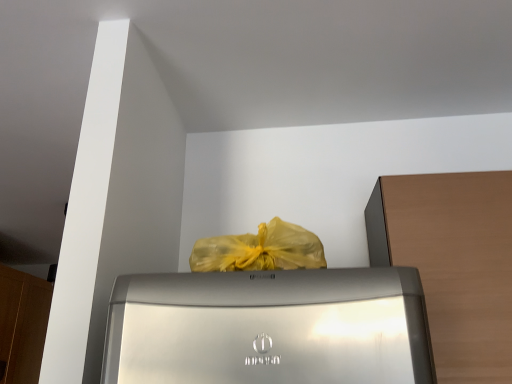
Locate an element on the screen. This screenshot has width=512, height=384. wooden cabinet at left, the 1th cabinetry when ordered from back to front is located at coordinates (22, 324).

Describe the element at coordinates (22, 324) in the screenshot. I see `wooden cabinet at left, the 1th cabinetry when ordered from back to front` at that location.

How much space does brown wood cabinet at right, placed as the 2th cabinetry when sorted from back to front, occupy horizontally?

The width of brown wood cabinet at right, placed as the 2th cabinetry when sorted from back to front, is 14.68 inches.

Identify the location of brown wood cabinet at right, which ranks as the 1th cabinetry in front-to-back order. (453, 263).

This screenshot has height=384, width=512. Describe the element at coordinates (453, 263) in the screenshot. I see `brown wood cabinet at right, which appears as the second cabinetry when viewed from the left` at that location.

At what (x,y) coordinates should I click in order to perform the action: click on wooden cabinet at left, the 1th cabinetry when ordered from back to front. Please return your answer as a coordinate pair (x, y). Looking at the image, I should click on (22, 324).

Is wooden cabinet at left, the 1th cabinetry when ordered from back to front, to the left or to the right of brown wood cabinet at right, the 1th cabinetry positioned from the right, in the image?

In the image, wooden cabinet at left, the 1th cabinetry when ordered from back to front, appears on the left side of brown wood cabinet at right, the 1th cabinetry positioned from the right.

Relative to brown wood cabinet at right, the 1th cabinetry positioned from the right, is wooden cabinet at left, which appears as the 1th cabinetry when viewed from the left, in front or behind?

Clearly, wooden cabinet at left, which appears as the 1th cabinetry when viewed from the left, is behind brown wood cabinet at right, the 1th cabinetry positioned from the right.

Does point (41, 285) come in front of point (511, 285)?

No, it is behind (511, 285).

From the image's perspective, which is above, wooden cabinet at left, the 1th cabinetry when ordered from back to front, or brown wood cabinet at right, the 1th cabinetry positioned from the right?

From the image's view, brown wood cabinet at right, the 1th cabinetry positioned from the right, is above.

From a real-world perspective, is wooden cabinet at left, positioned as the second cabinetry in right-to-left order, located beneath brown wood cabinet at right, which appears as the second cabinetry when viewed from the left?

Actually, wooden cabinet at left, positioned as the second cabinetry in right-to-left order, is physically above brown wood cabinet at right, which appears as the second cabinetry when viewed from the left, in the real world.

Is wooden cabinet at left, positioned as the second cabinetry in right-to-left order, wider than brown wood cabinet at right, placed as the 2th cabinetry when sorted from back to front?

No.

Which of these two, wooden cabinet at left, which appears as the 1th cabinetry when viewed from the left, or brown wood cabinet at right, the 1th cabinetry positioned from the right, stands taller?

wooden cabinet at left, which appears as the 1th cabinetry when viewed from the left.

Considering the sizes of objects wooden cabinet at left, the second cabinetry viewed from the front, and brown wood cabinet at right, the 1th cabinetry positioned from the right, in the image provided, who is smaller, wooden cabinet at left, the second cabinetry viewed from the front, or brown wood cabinet at right, the 1th cabinetry positioned from the right,?

With smaller size is wooden cabinet at left, the second cabinetry viewed from the front.

Is brown wood cabinet at right, placed as the 2th cabinetry when sorted from back to front, inside wooden cabinet at left, which appears as the 1th cabinetry when viewed from the left?

No, brown wood cabinet at right, placed as the 2th cabinetry when sorted from back to front, is not surrounded by wooden cabinet at left, which appears as the 1th cabinetry when viewed from the left.

Are wooden cabinet at left, the 1th cabinetry when ordered from back to front, and brown wood cabinet at right, placed as the 2th cabinetry when sorted from back to front, located far from each other?

Yes.

Is wooden cabinet at left, the second cabinetry viewed from the front, looking in the opposite direction of brown wood cabinet at right, the 1th cabinetry positioned from the right?

No, wooden cabinet at left, the second cabinetry viewed from the front, is not facing the opposite direction of brown wood cabinet at right, the 1th cabinetry positioned from the right.

Can you tell me how much wooden cabinet at left, the second cabinetry viewed from the front, and brown wood cabinet at right, placed as the 2th cabinetry when sorted from back to front, differ in facing direction?

The facing directions of wooden cabinet at left, the second cabinetry viewed from the front, and brown wood cabinet at right, placed as the 2th cabinetry when sorted from back to front, are 90 degrees apart.

This screenshot has height=384, width=512. In the image, there is a wooden cabinet at left, which appears as the 1th cabinetry when viewed from the left. What are the coordinates of `cabinetry above it (from the image's perspective)` in the screenshot? It's located at (453, 263).

Is brown wood cabinet at right, the 1th cabinetry positioned from the right, to the left or to the right of wooden cabinet at left, the second cabinetry viewed from the front, in the image?

brown wood cabinet at right, the 1th cabinetry positioned from the right, is to the right of wooden cabinet at left, the second cabinetry viewed from the front.

Considering their positions, is brown wood cabinet at right, which ranks as the 1th cabinetry in front-to-back order, located in front of or behind wooden cabinet at left, which appears as the 1th cabinetry when viewed from the left?

In the image, brown wood cabinet at right, which ranks as the 1th cabinetry in front-to-back order, appears in front of wooden cabinet at left, which appears as the 1th cabinetry when viewed from the left.

Does point (482, 344) come farther from viewer compared to point (44, 300)?

No, it is not.

From the image's perspective, between brown wood cabinet at right, the 1th cabinetry positioned from the right, and wooden cabinet at left, positioned as the second cabinetry in right-to-left order, who is located below?

wooden cabinet at left, positioned as the second cabinetry in right-to-left order, is shown below in the image.

From a real-world perspective, which is physically below, brown wood cabinet at right, placed as the 2th cabinetry when sorted from back to front, or wooden cabinet at left, the second cabinetry viewed from the front?

brown wood cabinet at right, placed as the 2th cabinetry when sorted from back to front, from a real-world perspective.

Looking at their sizes, would you say brown wood cabinet at right, placed as the 2th cabinetry when sorted from back to front, is wider or thinner than wooden cabinet at left, the 1th cabinetry when ordered from back to front?

Considering their sizes, brown wood cabinet at right, placed as the 2th cabinetry when sorted from back to front, looks broader than wooden cabinet at left, the 1th cabinetry when ordered from back to front.

Does brown wood cabinet at right, the 1th cabinetry positioned from the right, have a greater height compared to wooden cabinet at left, the 1th cabinetry when ordered from back to front?

In fact, brown wood cabinet at right, the 1th cabinetry positioned from the right, may be shorter than wooden cabinet at left, the 1th cabinetry when ordered from back to front.

Is brown wood cabinet at right, the 1th cabinetry positioned from the right, bigger than wooden cabinet at left, the 1th cabinetry when ordered from back to front?

Correct, brown wood cabinet at right, the 1th cabinetry positioned from the right, is larger in size than wooden cabinet at left, the 1th cabinetry when ordered from back to front.

Would you say brown wood cabinet at right, which appears as the second cabinetry when viewed from the left, is outside wooden cabinet at left, which appears as the 1th cabinetry when viewed from the left?

Indeed, brown wood cabinet at right, which appears as the second cabinetry when viewed from the left, is completely outside wooden cabinet at left, which appears as the 1th cabinetry when viewed from the left.

Is brown wood cabinet at right, which appears as the second cabinetry when viewed from the left, beside wooden cabinet at left, the second cabinetry viewed from the front?

There is a gap between brown wood cabinet at right, which appears as the second cabinetry when viewed from the left, and wooden cabinet at left, the second cabinetry viewed from the front.

Looking at this image, does brown wood cabinet at right, the 1th cabinetry positioned from the right, turn towards wooden cabinet at left, the second cabinetry viewed from the front?

No, brown wood cabinet at right, the 1th cabinetry positioned from the right, is not aimed at wooden cabinet at left, the second cabinetry viewed from the front.

I want to click on cabinetry above the brown wood cabinet at right, which ranks as the 1th cabinetry in front-to-back order (from a real-world perspective), so click(22, 324).

The width and height of the screenshot is (512, 384). Find the location of `cabinetry on the left side of brown wood cabinet at right, which appears as the second cabinetry when viewed from the left`. cabinetry on the left side of brown wood cabinet at right, which appears as the second cabinetry when viewed from the left is located at coordinates (22, 324).

Locate an element on the screen. This screenshot has width=512, height=384. cabinetry that appears below the brown wood cabinet at right, placed as the 2th cabinetry when sorted from back to front (from the image's perspective) is located at coordinates (22, 324).